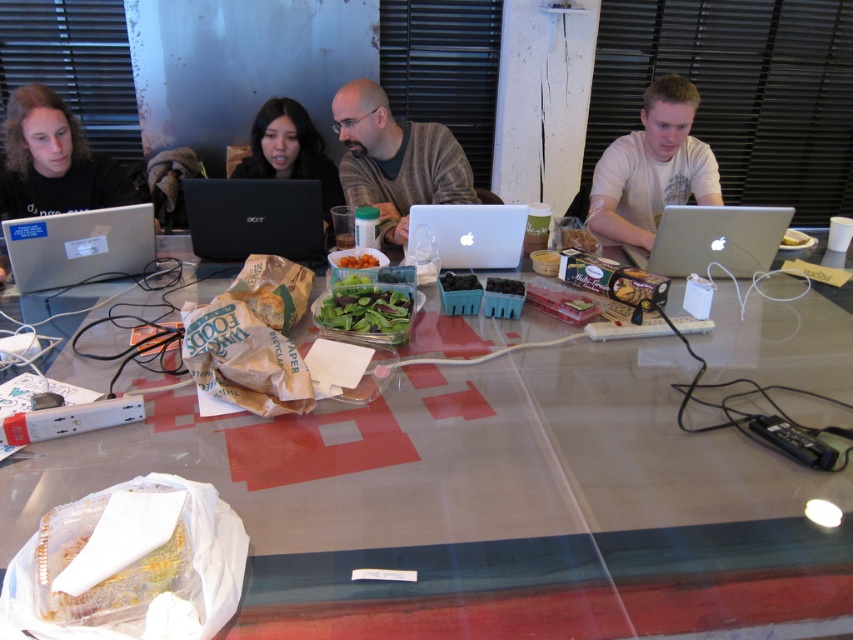
Is point (283, 112) positioned before point (354, 257)?

No, (283, 112) is behind (354, 257).

Does matte black laptop at center have a lesser width compared to orange matte tomatoes at center?

No.

Which is in front, point (299, 122) or point (351, 257)?

Point (351, 257) is more forward.

Find the location of a particular element. matte black laptop at center is located at coordinates (289, 150).

The image size is (853, 640). Describe the element at coordinates (473, 234) in the screenshot. I see `silver metallic laptop at center` at that location.

The image size is (853, 640). In order to click on silver metallic laptop at center in this screenshot , I will do `click(473, 234)`.

The height and width of the screenshot is (640, 853). I want to click on silver metallic laptop at center, so click(473, 234).

What do you see at coordinates (653, 168) in the screenshot?
I see `white matte shirt at right` at bounding box center [653, 168].

Is white matte shirt at right thinner than black matte shirt at left?

No, white matte shirt at right is not thinner than black matte shirt at left.

Is point (630, 221) positioned in front of point (96, 188)?

No, it is not.

Where is `white matte shirt at right`? white matte shirt at right is located at coordinates (653, 168).